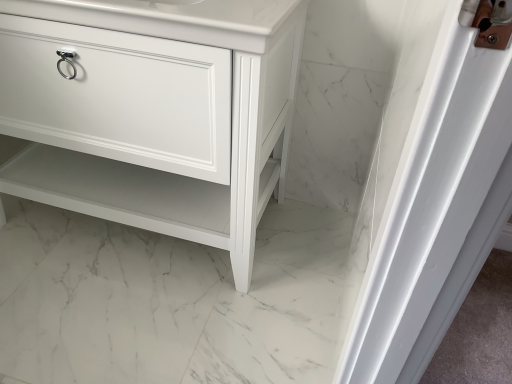
You are a GUI agent. You are given a task and a screenshot of the screen. Output one action in this format:
    pyautogui.click(x=<x>, y=<y>)
    Task: Click on the white painted wood cabinet at center
    
    Given the screenshot: What is the action you would take?
    pyautogui.click(x=152, y=111)

The image size is (512, 384). What do you see at coordinates (152, 111) in the screenshot?
I see `white painted wood cabinet at center` at bounding box center [152, 111].

Where is `white painted wood cabinet at center`? This screenshot has height=384, width=512. white painted wood cabinet at center is located at coordinates (152, 111).